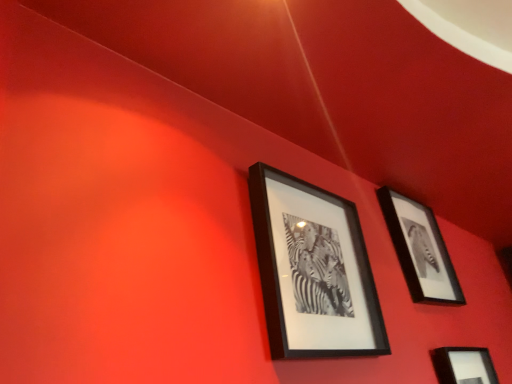
Question: Relative to black matte picture frame at upper right, which is counted as the second picture frame, starting from the left, is black matte picture frame at lower right, arranged as the first picture frame when viewed from the right, in front or behind?

Choices:
 (A) behind
 (B) front

Answer: (B)

Question: From their relative heights in the image, would you say black matte picture frame at lower right, placed as the 3th picture frame when sorted from left to right, is taller or shorter than black matte picture frame at upper right, marked as the second picture frame in a right-to-left arrangement?

Choices:
 (A) tall
 (B) short

Answer: (B)

Question: Which object is positioned closest to the black matte picture frame at upper right, marked as the second picture frame in a right-to-left arrangement?

Choices:
 (A) black matte picture frame at upper center, placed as the first picture frame when sorted from left to right
 (B) black matte picture frame at lower right, arranged as the first picture frame when viewed from the right

Answer: (B)

Question: Estimate the real-world distances between objects in this image. Which object is farther from the black matte picture frame at upper center, marked as the 3th picture frame in a right-to-left arrangement?

Choices:
 (A) black matte picture frame at lower right, arranged as the first picture frame when viewed from the right
 (B) black matte picture frame at upper right, which is counted as the second picture frame, starting from the left

Answer: (A)